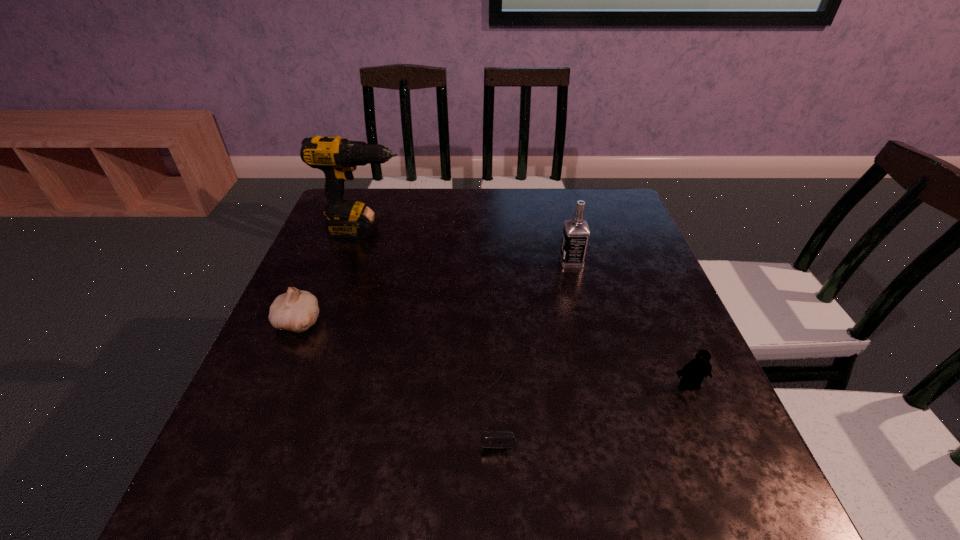
Locate an element on the screen. The image size is (960, 540). the tallest object is located at coordinates (337, 157).

Locate an element on the screen. This screenshot has height=540, width=960. the farthest object is located at coordinates (337, 157).

What are the coordinates of `vodka` in the screenshot? It's located at (576, 232).

Find the location of a particular element. The image size is (960, 540). the second tallest object is located at coordinates (576, 232).

The height and width of the screenshot is (540, 960). What are the coordinates of `garlic` in the screenshot? It's located at (297, 310).

At what (x,y) coordinates should I click in order to perform the action: click on Lego. Please return your answer as a coordinate pair (x, y). This screenshot has height=540, width=960. Looking at the image, I should click on (693, 373).

Where is `webcam`? webcam is located at coordinates (498, 439).

The height and width of the screenshot is (540, 960). What are the coordinates of `the shortest object` in the screenshot? It's located at (498, 439).

Where is `free region located 0.370m at the tip of the drill`? The height and width of the screenshot is (540, 960). free region located 0.370m at the tip of the drill is located at coordinates (537, 231).

Where is `vacant space located on the front label of the second tallest object`? vacant space located on the front label of the second tallest object is located at coordinates (472, 261).